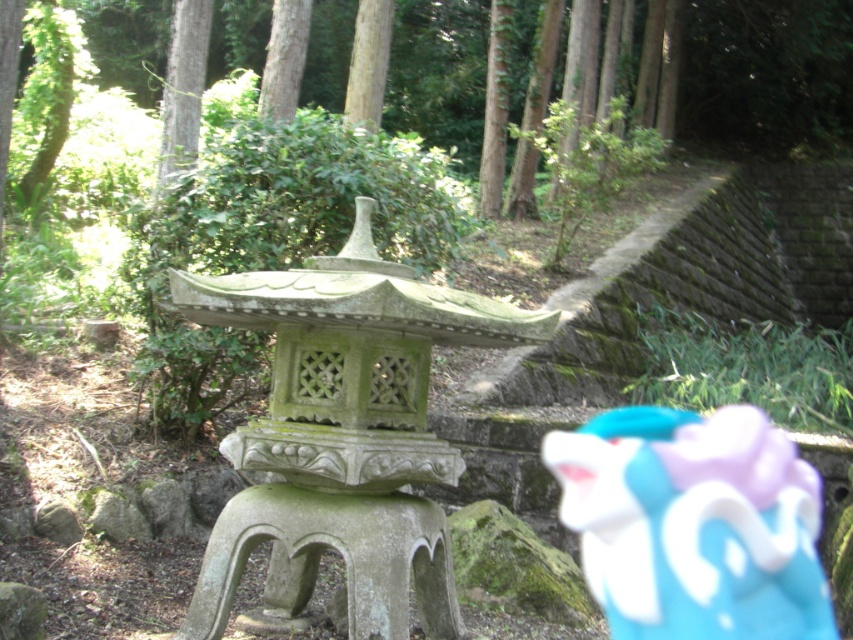
Which is below, green leafy tree at upper left or green rough bark tree at upper left?

green rough bark tree at upper left is lower down.

Which is more to the right, green leafy tree at upper left or green rough bark tree at upper left?

From the viewer's perspective, green rough bark tree at upper left appears more on the right side.

Locate an element on the screen. green leafy tree at upper left is located at coordinates (48, 90).

Does smooth bark tree at upper center have a larger size compared to smooth brown tree trunk at upper center?

Yes, smooth bark tree at upper center is bigger than smooth brown tree trunk at upper center.

Can you confirm if smooth bark tree at upper center is positioned to the right of smooth brown tree trunk at upper center?

Indeed, smooth bark tree at upper center is positioned on the right side of smooth brown tree trunk at upper center.

Identify the location of smooth bark tree at upper center. This screenshot has height=640, width=853. (368, 64).

Image resolution: width=853 pixels, height=640 pixels. I want to click on smooth bark tree at upper center, so click(x=368, y=64).

Between point (50, 45) and point (364, 60), which one is positioned behind?

Point (50, 45)

Between point (77, 60) and point (370, 68), which one is positioned in front?

Point (370, 68)

Where is `green leafy tree at upper left`? This screenshot has width=853, height=640. green leafy tree at upper left is located at coordinates (48, 90).